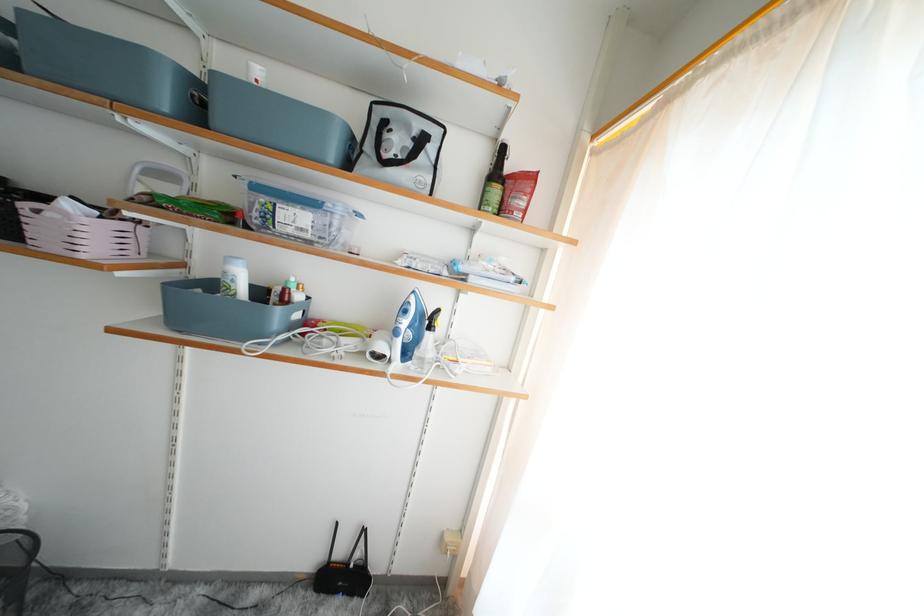
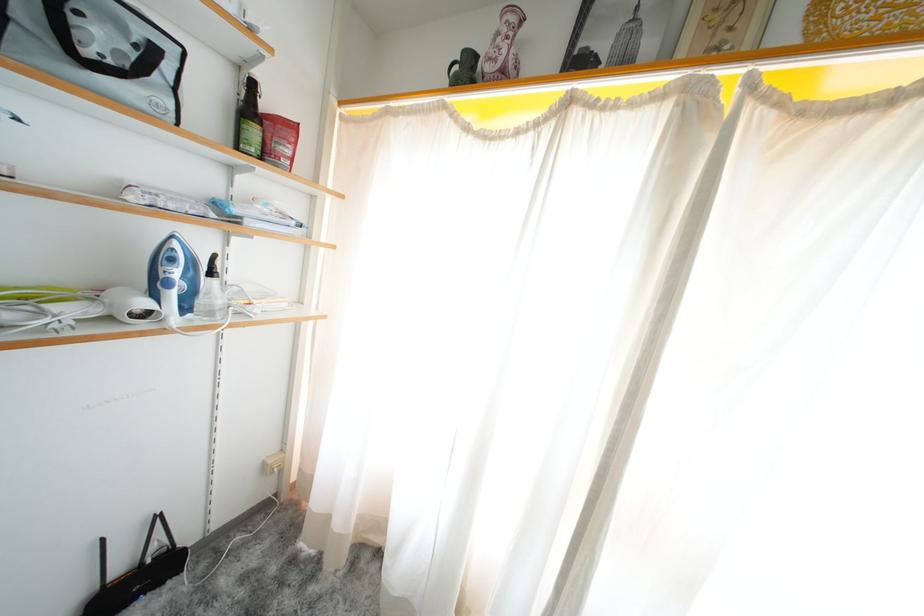
Locate, in the second image, the point that corresponds to (x=502, y=197) in the first image.

(261, 137)